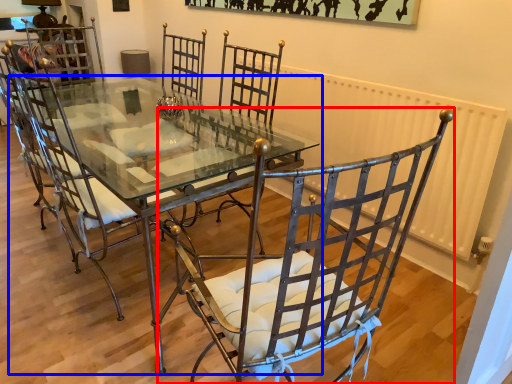
Question: Which object appears farthest to the camera in this image, chair (highlighted by a red box) or table (highlighted by a blue box)?

Choices:
 (A) chair
 (B) table

Answer: (B)